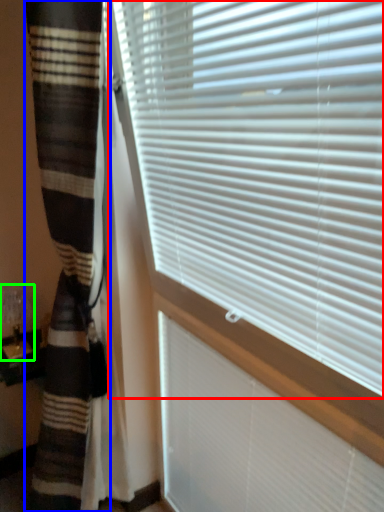
Question: Which object is positioned farthest from window blind (highlighted by a red box)? Select from curtain (highlighted by a blue box) and table lamp (highlighted by a green box).

Choices:
 (A) curtain
 (B) table lamp

Answer: (B)